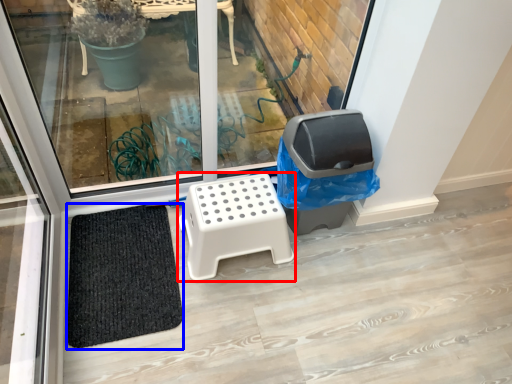
Question: Among these objects, which one is nearest to the camera, furniture (highlighted by a red box) or doormat (highlighted by a blue box)?

Choices:
 (A) furniture
 (B) doormat

Answer: (B)